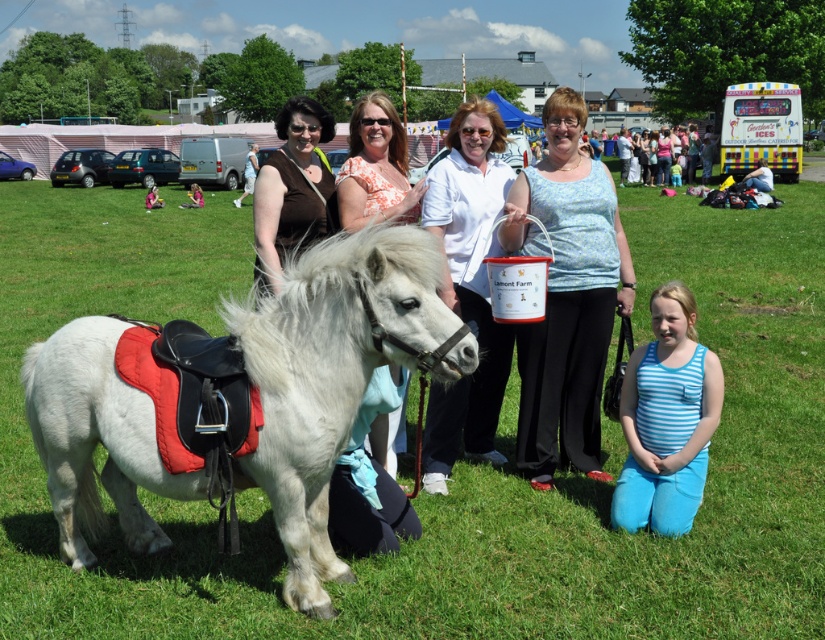
You are standing at the origin point in the scene. You want to walk towards the green grass at center. What direction should you walk in?

The green grass at center is located at coordinate point 0.722 on the x axis and 0.555 on the y axis, so you should walk towards the right and slightly forward to reach it.

You are at a community fair and see the green grass at center and the orange floral blouse at center. Which object takes up more space in the image?

The orange floral blouse at center takes up more space in the image because the green grass at center is smaller than the orange floral blouse at center.